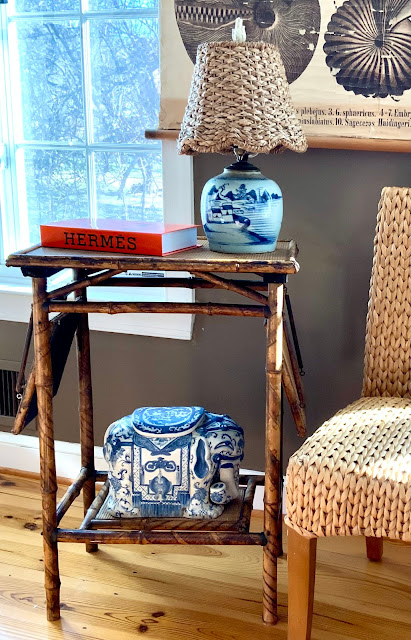
You are a GUI agent. You are given a task and a screenshot of the screen. Output one action in this format:
    pyautogui.click(x=<x>, y=<y>)
    Task: Click on the chair
    The width and height of the screenshot is (411, 640).
    Given the screenshot: What is the action you would take?
    [399, 347]